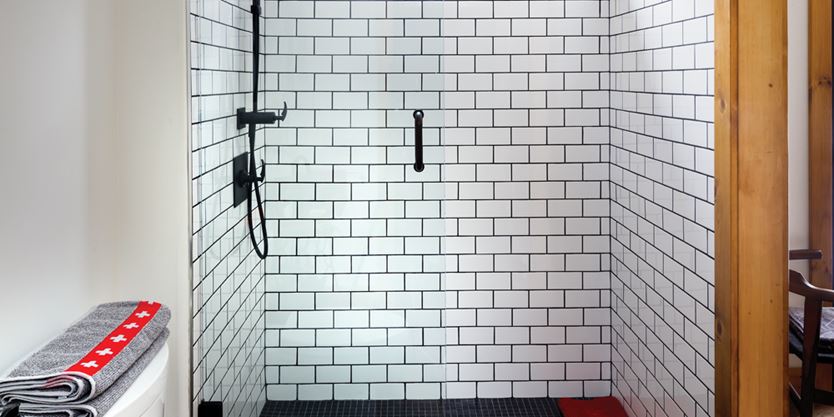
Identify the location of handle. This screenshot has height=417, width=834. (417, 141).